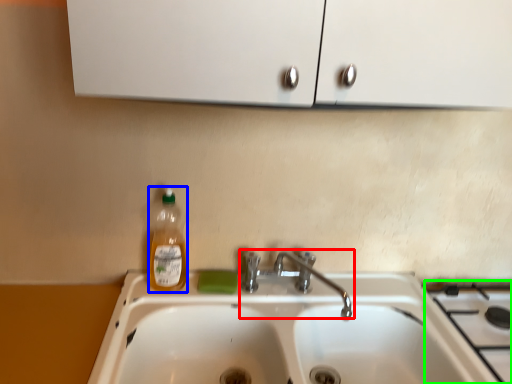
Question: Estimate the real-world distances between objects in this image. Which object is farther from tap (highlighted by a red box), bottle (highlighted by a blue box) or gas stove (highlighted by a green box)?

Choices:
 (A) bottle
 (B) gas stove

Answer: (B)